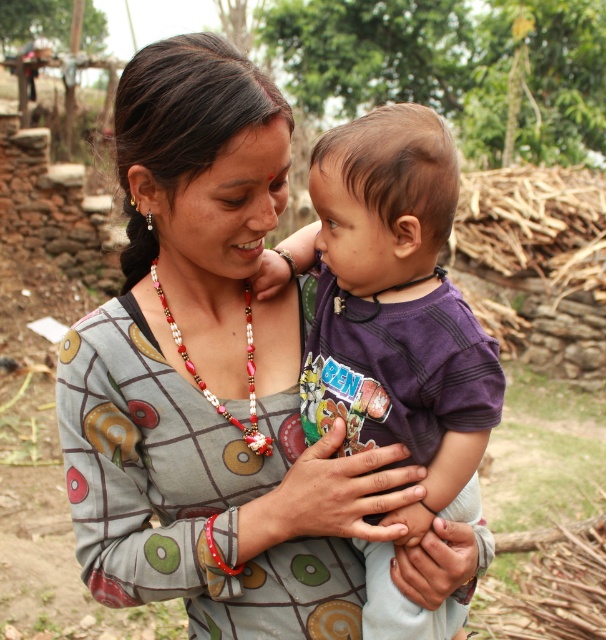
Question: Which point is closer to the camera?

Choices:
 (A) beaded necklace at center
 (B) printed fabric dress at center

Answer: (B)

Question: Is purple cotton shirt at center thinner than beaded necklace at center?

Choices:
 (A) yes
 (B) no

Answer: (B)

Question: Does printed fabric dress at center appear on the left side of purple cotton shirt at center?

Choices:
 (A) no
 (B) yes

Answer: (B)

Question: Which point is closer to the camera?

Choices:
 (A) printed fabric dress at center
 (B) purple cotton shirt at center
 (C) beaded necklace at center

Answer: (A)

Question: In this image, where is purple cotton shirt at center located relative to beaded necklace at center?

Choices:
 (A) left
 (B) right

Answer: (B)

Question: Which object appears farthest from the camera in this image?

Choices:
 (A) printed fabric dress at center
 (B) purple cotton shirt at center

Answer: (B)